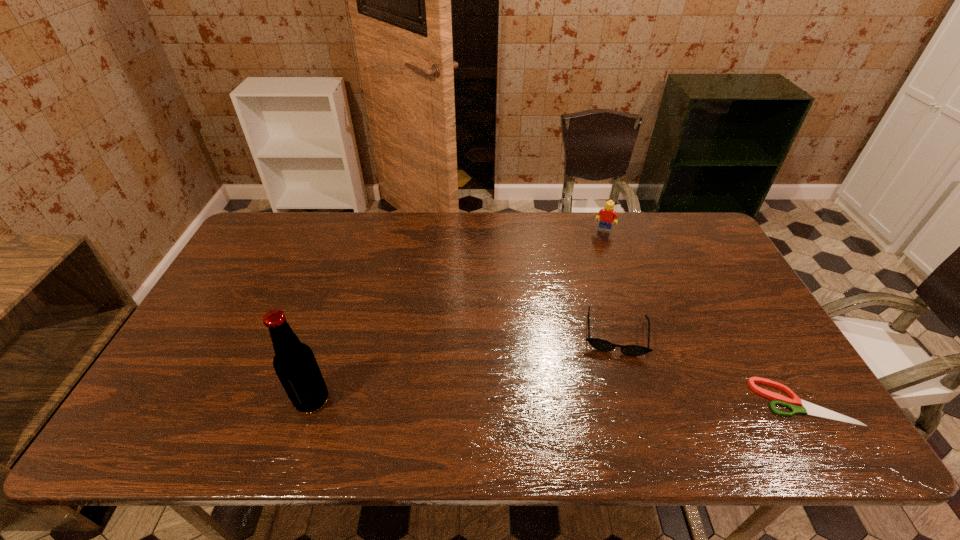
Where is `beer bottle`? Image resolution: width=960 pixels, height=540 pixels. beer bottle is located at coordinates (294, 362).

At what (x,y) coordinates should I click in order to perform the action: click on the leftmost object. Please return your answer as a coordinate pair (x, y). The width and height of the screenshot is (960, 540). Looking at the image, I should click on (294, 362).

Locate an element on the screen. The width and height of the screenshot is (960, 540). the shortest object is located at coordinates (794, 404).

This screenshot has height=540, width=960. Find the location of `the rightmost object`. the rightmost object is located at coordinates (794, 404).

I want to click on the farthest object, so click(x=607, y=215).

Image resolution: width=960 pixels, height=540 pixels. Identify the location of the second tallest object. click(607, 215).

In order to click on the second shortest object in this screenshot , I will do pyautogui.click(x=600, y=344).

You are a GUI agent. You are given a task and a screenshot of the screen. Output one action in this format:
    pyautogui.click(x=<x>, y=<y>)
    Task: Click on the sunglasses
    This screenshot has width=960, height=540.
    Given the screenshot: What is the action you would take?
    pyautogui.click(x=600, y=344)

This screenshot has width=960, height=540. Identify the location of free spot located on the right of the tallest object. (375, 400).

Where is `vacant space located 0.320m on the left of the scissors`? This screenshot has height=540, width=960. vacant space located 0.320m on the left of the scissors is located at coordinates (623, 402).